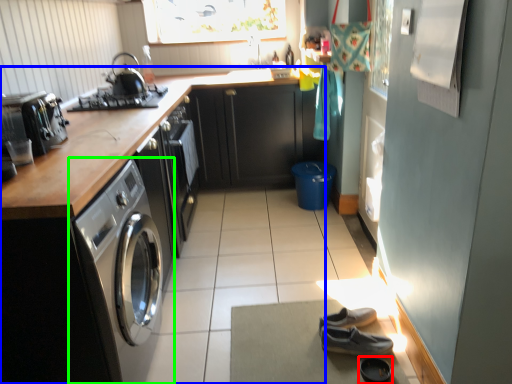
Question: Considering the real-world distances, which object is closest to shoe (highlighted by a red box)? cabinetry (highlighted by a blue box) or washing machine (highlighted by a green box).

Choices:
 (A) cabinetry
 (B) washing machine

Answer: (B)